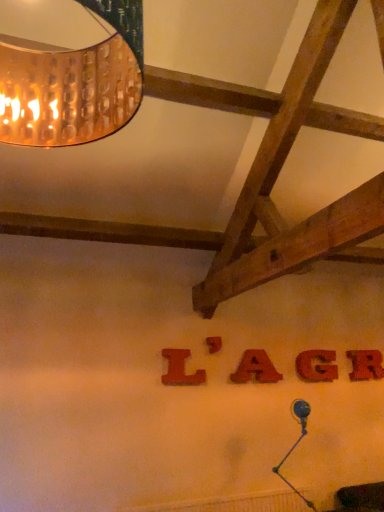
Question: Is point (370, 377) positioned closer to the camera than point (221, 342)?

Choices:
 (A) closer
 (B) farther

Answer: (B)

Question: Looking at their shapes, would you say red wood letter at center, placed as the 1th letter when sorted from right to left, is wider or thinner than wooden letter at center, the second letter when ordered from left to right?

Choices:
 (A) wide
 (B) thin

Answer: (A)

Question: Estimate the real-world distances between objects in this image. Which object is closer to the red felt letter a at center, which ranks as the third letter in left-to-right order?

Choices:
 (A) matte red letter at center, the first letter viewed from the left
 (B) red wood letter at center, placed as the 1th letter when sorted from right to left
 (C) wooden letter at center, the second letter when ordered from left to right
 (D) red matte letter g at center, the 4th letter when ordered from left to right
 (E) copper textured lampshade at upper left

Answer: (C)

Question: Considering the real-world distances, which object is farthest from the copper textured lampshade at upper left?

Choices:
 (A) red matte letter g at center, marked as the 2th letter in a right-to-left arrangement
 (B) wooden letter at center, the 4th letter in the right-to-left sequence
 (C) red felt letter a at center, which ranks as the third letter in left-to-right order
 (D) matte red letter at center, which appears as the 5th letter when viewed from the right
 (E) red wood letter at center, the fifth letter viewed from the left

Answer: (E)